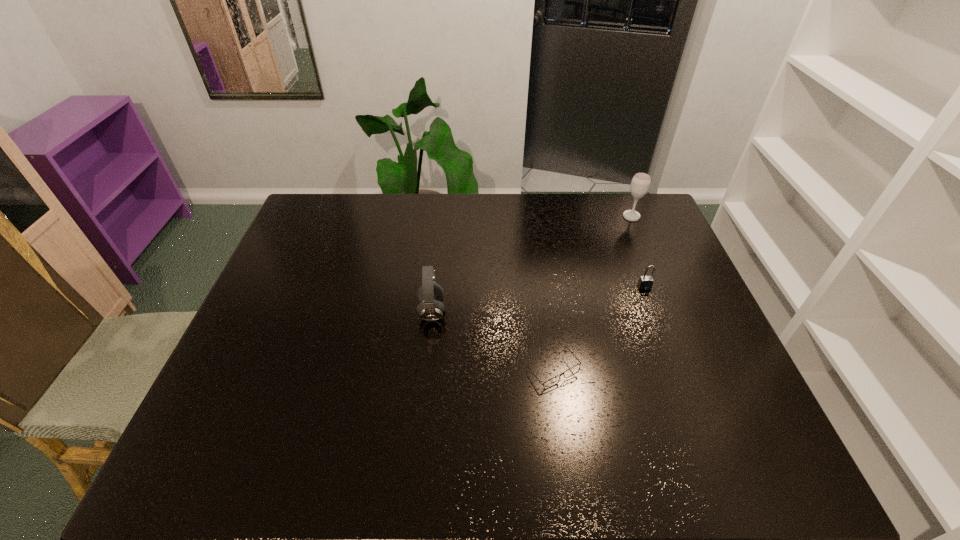
This screenshot has width=960, height=540. I want to click on object that is the third closest to the headset, so click(640, 184).

At what (x,y) coordinates should I click in order to perform the action: click on object that stands as the closest to the second farthest object. Please return your answer as a coordinate pair (x, y). Looking at the image, I should click on (640, 184).

This screenshot has width=960, height=540. What are the coordinates of `vacant area in the image that satisfies the following two spatial constraints: 1. on the shackle of the third nearest object; 2. on the ear cups of the headset` in the screenshot? It's located at (654, 311).

This screenshot has height=540, width=960. What are the coordinates of `blank area in the image that satisfies the following two spatial constraints: 1. on the shackle of the third tallest object; 2. on the ear cups of the headset` in the screenshot? It's located at (654, 311).

Where is `vacant area in the image that satisfies the following two spatial constraints: 1. on the shackle of the second shortest object; 2. on the ear cups of the leftmost object`? This screenshot has height=540, width=960. vacant area in the image that satisfies the following two spatial constraints: 1. on the shackle of the second shortest object; 2. on the ear cups of the leftmost object is located at coordinates (654, 311).